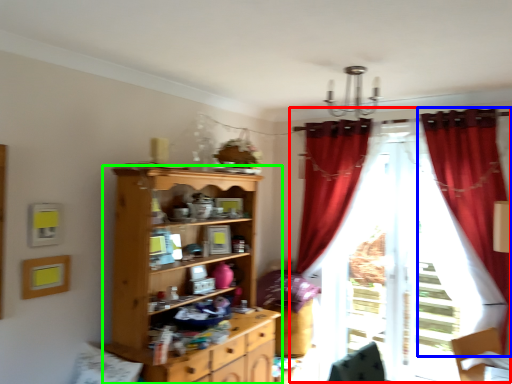
Question: Which object is the closest to the curtain (highlighted by a red box)? Choose among these: curtain (highlighted by a blue box) or cupboard (highlighted by a green box).

Choices:
 (A) curtain
 (B) cupboard

Answer: (A)